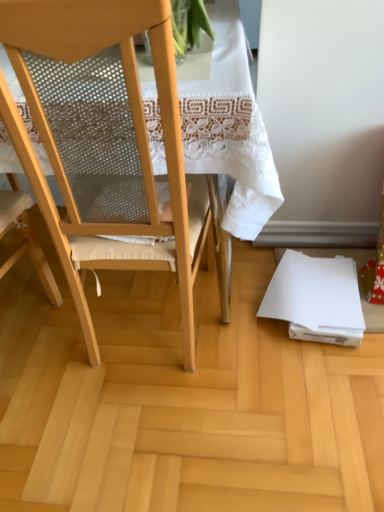
Question: Is wooden floor at lower right in front of matte wood chair at center?

Choices:
 (A) yes
 (B) no

Answer: (B)

Question: From a real-world perspective, is wooden floor at lower right located higher than matte wood chair at center?

Choices:
 (A) yes
 (B) no

Answer: (B)

Question: Are wooden floor at lower right and matte wood chair at center making contact?

Choices:
 (A) yes
 (B) no

Answer: (B)

Question: Is wooden floor at lower right thinner than matte wood chair at center?

Choices:
 (A) no
 (B) yes

Answer: (A)

Question: Is matte wood chair at center a part of wooden floor at lower right?

Choices:
 (A) no
 (B) yes

Answer: (A)

Question: Is wooden floor at lower right at the right side of matte wood chair at center?

Choices:
 (A) yes
 (B) no

Answer: (A)

Question: Does white paper at lower right have a greater height compared to wooden floor at lower right?

Choices:
 (A) no
 (B) yes

Answer: (B)

Question: Can you see white paper at lower right touching wooden floor at lower right?

Choices:
 (A) yes
 (B) no

Answer: (B)

Question: Is white paper at lower right not near wooden floor at lower right?

Choices:
 (A) no
 (B) yes

Answer: (A)

Question: From a real-world perspective, is white paper at lower right positioned over wooden floor at lower right based on gravity?

Choices:
 (A) yes
 (B) no

Answer: (A)

Question: Could you tell me if white paper at lower right is facing wooden floor at lower right?

Choices:
 (A) yes
 (B) no

Answer: (B)

Question: Is white paper at lower right bigger than wooden floor at lower right?

Choices:
 (A) no
 (B) yes

Answer: (A)

Question: Does white paper at lower right lie behind matte wood chair at center?

Choices:
 (A) yes
 (B) no

Answer: (A)